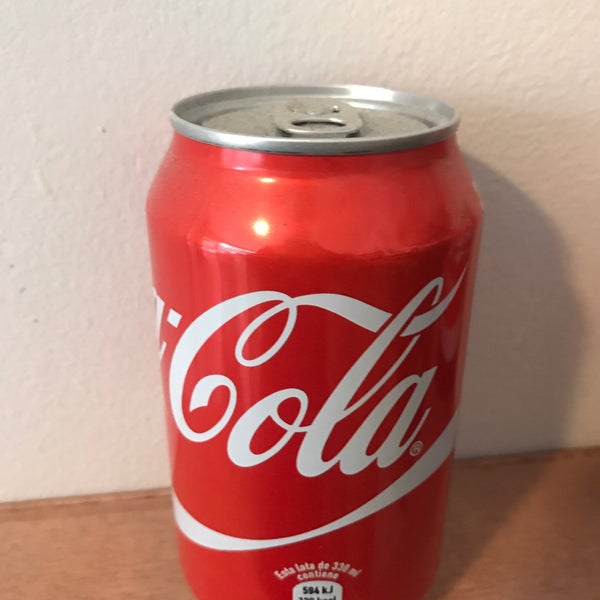
Where is `wooden counter top`? The height and width of the screenshot is (600, 600). wooden counter top is located at coordinates (124, 582), (538, 572).